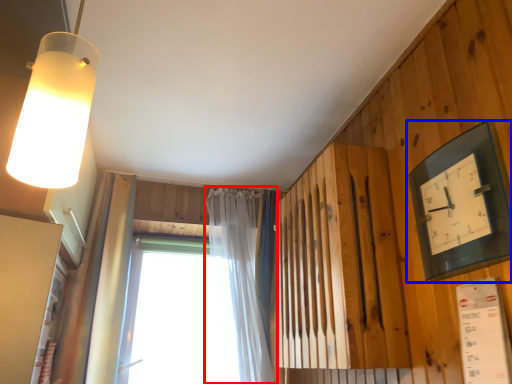
Question: Which of the following is the farthest to the observer, curtain (highlighted by a red box) or clock (highlighted by a blue box)?

Choices:
 (A) curtain
 (B) clock

Answer: (A)